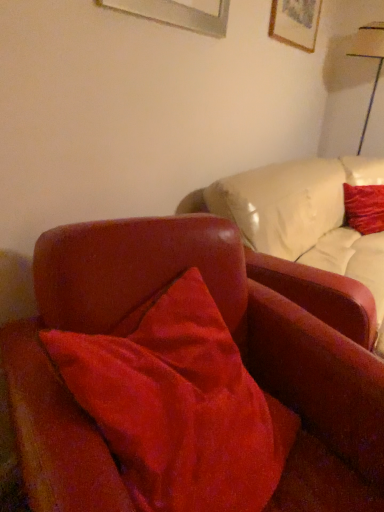
Question: From a real-world perspective, is wooden picture frame at upper right beneath white glossy table lamp at upper right?

Choices:
 (A) yes
 (B) no

Answer: (B)

Question: Can you confirm if wooden picture frame at upper right is thinner than white glossy table lamp at upper right?

Choices:
 (A) yes
 (B) no

Answer: (A)

Question: Is wooden picture frame at upper right aimed at white glossy table lamp at upper right?

Choices:
 (A) no
 (B) yes

Answer: (A)

Question: From the image's perspective, is wooden picture frame at upper right over white glossy table lamp at upper right?

Choices:
 (A) yes
 (B) no

Answer: (A)

Question: Is wooden picture frame at upper right not within white glossy table lamp at upper right?

Choices:
 (A) no
 (B) yes

Answer: (B)

Question: Is wooden picture frame at upper right positioned in front of white glossy table lamp at upper right?

Choices:
 (A) no
 (B) yes

Answer: (B)

Question: From a real-world perspective, is velvet red chair at center positioned under white glossy table lamp at upper right based on gravity?

Choices:
 (A) no
 (B) yes

Answer: (B)

Question: From the image's perspective, is velvet red chair at center beneath white glossy table lamp at upper right?

Choices:
 (A) no
 (B) yes

Answer: (B)

Question: Is velvet red chair at center touching white glossy table lamp at upper right?

Choices:
 (A) yes
 (B) no

Answer: (B)

Question: Can white glossy table lamp at upper right be found inside velvet red chair at center?

Choices:
 (A) yes
 (B) no

Answer: (B)

Question: Are velvet red chair at center and white glossy table lamp at upper right located far from each other?

Choices:
 (A) yes
 (B) no

Answer: (A)

Question: Does velvet red chair at center have a larger size compared to white glossy table lamp at upper right?

Choices:
 (A) yes
 (B) no

Answer: (A)

Question: Considering the relative positions of velvet red pillow at upper right and white glossy table lamp at upper right in the image provided, is velvet red pillow at upper right to the left of white glossy table lamp at upper right from the viewer's perspective?

Choices:
 (A) yes
 (B) no

Answer: (A)